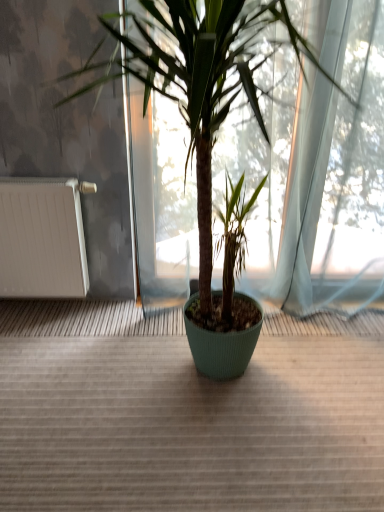
At what (x,y) coordinates should I click in order to perform the action: click on vacant region under green ribbed pot at center (from a real-world perspective). Please return your answer as a coordinate pair (x, y). The image size is (384, 512). Looking at the image, I should click on (192, 384).